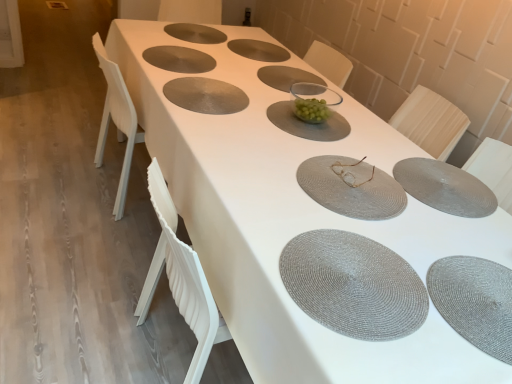
Where is `empty space that is ontop of green glass bowl at center, arranged as the 5th tableware when ordered from the bottom (from a real-world perspective)`? The image size is (512, 384). empty space that is ontop of green glass bowl at center, arranged as the 5th tableware when ordered from the bottom (from a real-world perspective) is located at coordinates (302, 115).